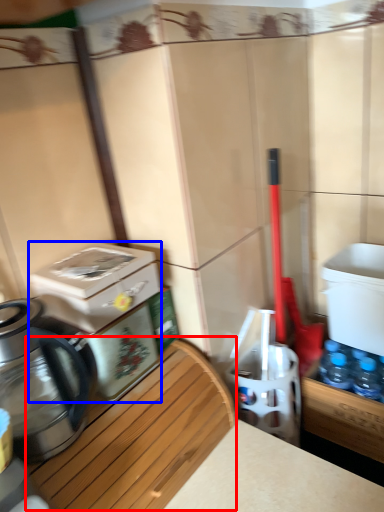
Question: Which object appears farthest to the camera in this image, wood (highlighted by a red box) or water cooler (highlighted by a blue box)?

Choices:
 (A) wood
 (B) water cooler

Answer: (B)